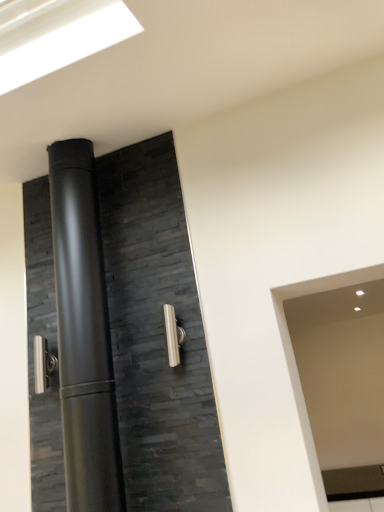
Question: Can we say matte black door at center lies outside satin nickel door handle at left, the second door handle from the front?

Choices:
 (A) no
 (B) yes

Answer: (B)

Question: Is matte black door at center facing towards satin nickel door handle at left, the 1th door handle when ordered from back to front?

Choices:
 (A) yes
 (B) no

Answer: (B)

Question: Does matte black door at center contain satin nickel door handle at left, which appears as the second door handle when viewed from the right?

Choices:
 (A) no
 (B) yes

Answer: (A)

Question: From a real-world perspective, is matte black door at center located higher than satin nickel door handle at left, placed as the first door handle when sorted from left to right?

Choices:
 (A) no
 (B) yes

Answer: (B)

Question: Does matte black door at center have a lesser width compared to satin nickel door handle at left, placed as the first door handle when sorted from left to right?

Choices:
 (A) yes
 (B) no

Answer: (B)

Question: From a real-world perspective, is matte black door at center positioned under satin nickel door handle at left, the second door handle from the front, based on gravity?

Choices:
 (A) yes
 (B) no

Answer: (B)

Question: Is matte black door at center smaller than satin nickel door handle at center, placed as the 2th door handle when sorted from back to front?

Choices:
 (A) yes
 (B) no

Answer: (B)

Question: Does matte black door at center come behind satin nickel door handle at center, placed as the 2th door handle when sorted from back to front?

Choices:
 (A) yes
 (B) no

Answer: (B)

Question: Is matte black door at center to the right of satin nickel door handle at center, the 1th door handle positioned from the right, from the viewer's perspective?

Choices:
 (A) no
 (B) yes

Answer: (A)

Question: From a real-world perspective, is matte black door at center over satin nickel door handle at center, the 1th door handle positioned from the right?

Choices:
 (A) no
 (B) yes

Answer: (B)

Question: From the image's perspective, does matte black door at center appear higher than satin nickel door handle at center, which is the 1th door handle from front to back?

Choices:
 (A) no
 (B) yes

Answer: (B)

Question: Is matte black door at center far away from satin nickel door handle at center, placed as the 2th door handle when sorted from back to front?

Choices:
 (A) no
 (B) yes

Answer: (A)

Question: Is matte black door at center at the back of satin nickel door handle at center, placed as the 2th door handle when sorted from back to front?

Choices:
 (A) yes
 (B) no

Answer: (B)